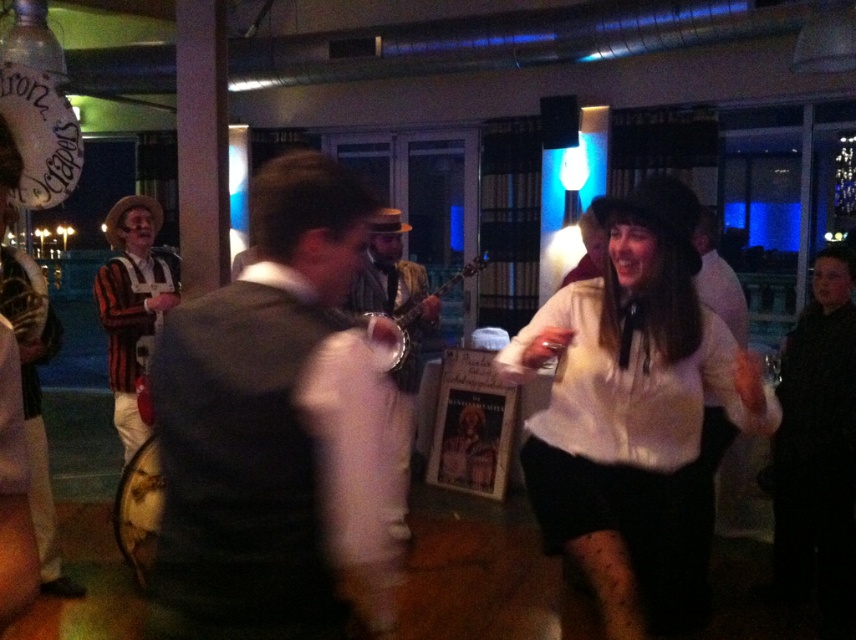
Question: Is dark gray suit at center to the left of black matte dress at right from the viewer's perspective?

Choices:
 (A) yes
 (B) no

Answer: (A)

Question: Estimate the real-world distances between objects in this image. Which object is farther from the white matte dress at center?

Choices:
 (A) shiny brown leather jacket at center
 (B) dark gray suit at center
 (C) wooden banjo at center
 (D) white matte shirt at center

Answer: (B)

Question: Among these points, which one is farthest from the camera?

Choices:
 (A) (720, 369)
 (B) (420, 275)

Answer: (B)

Question: Where is black matte dress at right located in relation to wooden banjo at center in the image?

Choices:
 (A) left
 (B) right

Answer: (B)

Question: In this image, where is white matte dress at center located relative to wooden banjo at center?

Choices:
 (A) below
 (B) above

Answer: (A)

Question: Based on their relative distances, which object is nearer to the white matte dress at center?

Choices:
 (A) black matte dress at right
 (B) wooden banjo at center

Answer: (B)